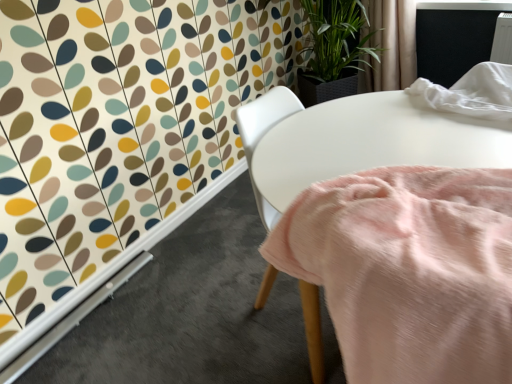
This screenshot has width=512, height=384. I want to click on pink soft fabric at center, so click(x=353, y=142).

What do you see at coordinates (353, 142) in the screenshot?
I see `pink soft fabric at center` at bounding box center [353, 142].

What do you see at coordinates (391, 45) in the screenshot? The height and width of the screenshot is (384, 512). I see `beige fabric curtain at upper right` at bounding box center [391, 45].

Find the location of a particular element. This screenshot has height=384, width=512. beige fabric curtain at upper right is located at coordinates (391, 45).

The width and height of the screenshot is (512, 384). I want to click on pink soft fabric at center, so click(353, 142).

Considering the relative positions of pink soft fabric at center and beige fabric curtain at upper right in the image provided, is pink soft fabric at center to the left or to the right of beige fabric curtain at upper right?

Clearly, pink soft fabric at center is on the left of beige fabric curtain at upper right in the image.

Which is behind, pink soft fabric at center or beige fabric curtain at upper right?

beige fabric curtain at upper right is behind.

Considering the points (497, 142) and (391, 23), which point is in front, point (497, 142) or point (391, 23)?

Point (497, 142)

From the image's perspective, is pink soft fabric at center located above beige fabric curtain at upper right?

No, from the image's perspective, pink soft fabric at center is not above beige fabric curtain at upper right.

From a real-world perspective, is pink soft fabric at center on beige fabric curtain at upper right?

No, from a real-world perspective, pink soft fabric at center is not over beige fabric curtain at upper right

Consider the image. Which object is thinner, pink soft fabric at center or beige fabric curtain at upper right?

Thinner between the two is beige fabric curtain at upper right.

Can you confirm if pink soft fabric at center is taller than beige fabric curtain at upper right?

Indeed, pink soft fabric at center has a greater height compared to beige fabric curtain at upper right.

Between pink soft fabric at center and beige fabric curtain at upper right, which one has smaller size?

beige fabric curtain at upper right.

Is beige fabric curtain at upper right surrounded by pink soft fabric at center?

No, beige fabric curtain at upper right is not a part of pink soft fabric at center.

Can you see pink soft fabric at center touching beige fabric curtain at upper right?

pink soft fabric at center and beige fabric curtain at upper right are clearly separated.

Could you tell me if pink soft fabric at center is turned towards beige fabric curtain at upper right?

No, pink soft fabric at center is not oriented towards beige fabric curtain at upper right.

Can you tell me how much pink soft fabric at center and beige fabric curtain at upper right differ in facing direction?

They differ by 178 degrees in their facing directions.

Measure the distance between pink soft fabric at center and beige fabric curtain at upper right.

pink soft fabric at center and beige fabric curtain at upper right are 4.88 feet apart.

Find the location of a particular element. The image size is (512, 384). table on the left side of beige fabric curtain at upper right is located at coordinates (353, 142).

Between beige fabric curtain at upper right and pink soft fabric at center, which one appears on the left side from the viewer's perspective?

From the viewer's perspective, pink soft fabric at center appears more on the left side.

Between beige fabric curtain at upper right and pink soft fabric at center, which one is positioned in front?

pink soft fabric at center.

Does point (400, 60) lie in front of point (367, 126)?

No, it is behind (367, 126).

From the image's perspective, relative to pink soft fabric at center, is beige fabric curtain at upper right above or below?

From the image's perspective, beige fabric curtain at upper right appears above pink soft fabric at center.

From a real-world perspective, does beige fabric curtain at upper right sit lower than pink soft fabric at center?

Actually, beige fabric curtain at upper right is physically above pink soft fabric at center in the real world.

Is beige fabric curtain at upper right thinner than pink soft fabric at center?

Result: Indeed, beige fabric curtain at upper right has a lesser width compared to pink soft fabric at center.

Between beige fabric curtain at upper right and pink soft fabric at center, which one has less height?

beige fabric curtain at upper right.

Can you confirm if beige fabric curtain at upper right is smaller than pink soft fabric at center?

Yes, beige fabric curtain at upper right is smaller than pink soft fabric at center.

Is beige fabric curtain at upper right inside or outside of pink soft fabric at center?

beige fabric curtain at upper right cannot be found inside pink soft fabric at center.

Would you consider beige fabric curtain at upper right to be distant from pink soft fabric at center?

beige fabric curtain at upper right is positioned a significant distance from pink soft fabric at center.

Is beige fabric curtain at upper right turned away from pink soft fabric at center?

That's not correct — beige fabric curtain at upper right is not looking away from pink soft fabric at center.

Measure the distance between beige fabric curtain at upper right and pink soft fabric at center.

A distance of 4.88 feet exists between beige fabric curtain at upper right and pink soft fabric at center.

Identify the location of table located in front of the beige fabric curtain at upper right. Image resolution: width=512 pixels, height=384 pixels. (353, 142).

In the image, there is a beige fabric curtain at upper right. In order to click on table below it (from a real-world perspective) in this screenshot , I will do `click(353, 142)`.

In the image, there is a pink soft fabric at center. At what (x,y) coordinates should I click in order to perform the action: click on curtain above it (from the image's perspective). Please return your answer as a coordinate pair (x, y). The image size is (512, 384). Looking at the image, I should click on (391, 45).